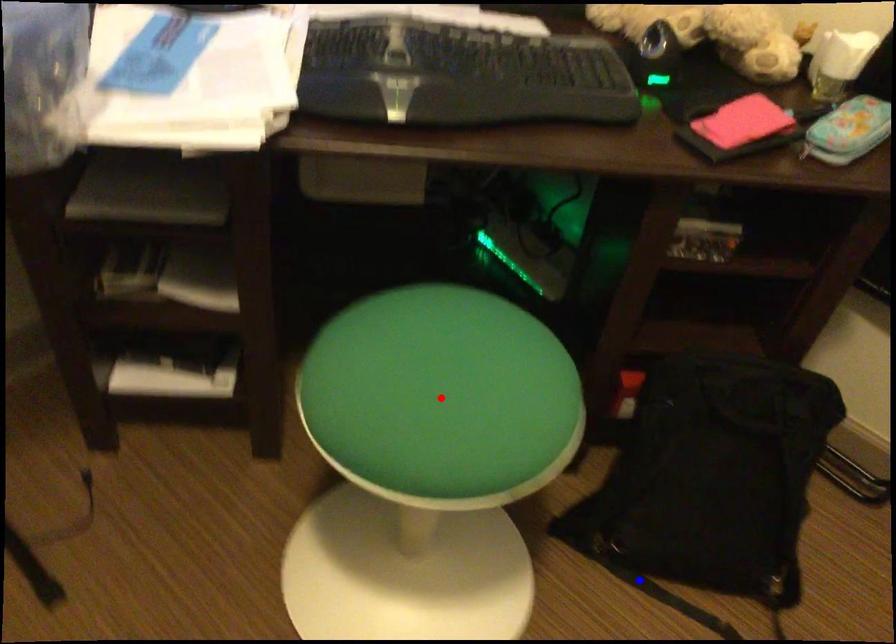
Question: Which of the two points in the image is closer to the camera?

Choices:
 (A) Blue point is closer.
 (B) Red point is closer.

Answer: (B)